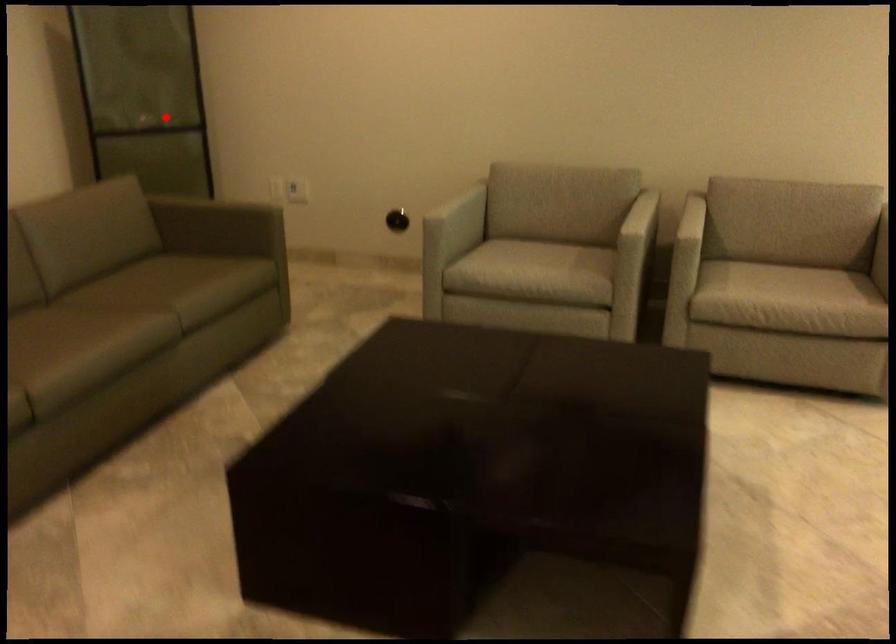
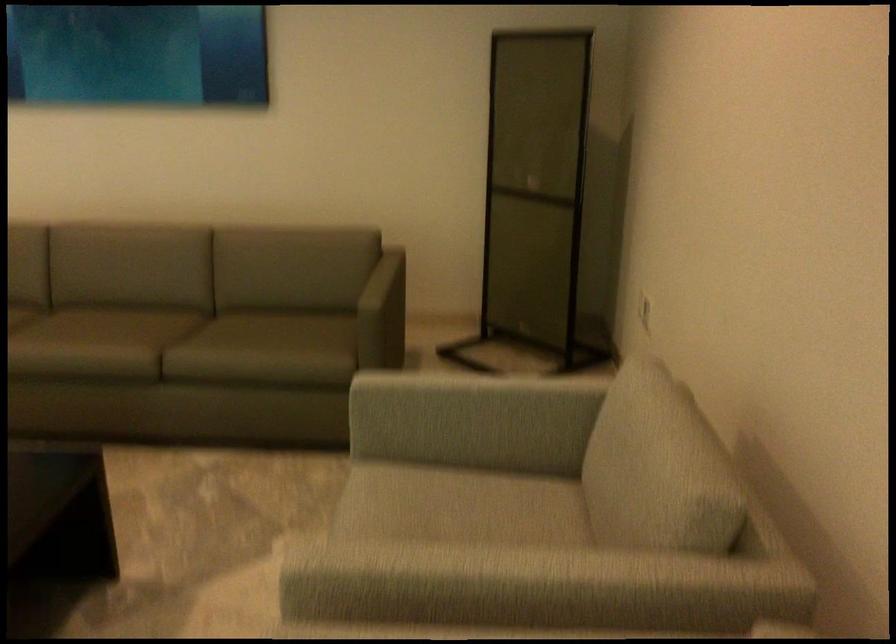
Question: I am providing you with two images of the same scene from different viewpoints. In image1, a red point is highlighted. Considering the same 3D point in image2, which of the following is correct?

Choices:
 (A) It is closer
 (B) It is farther

Answer: (A)